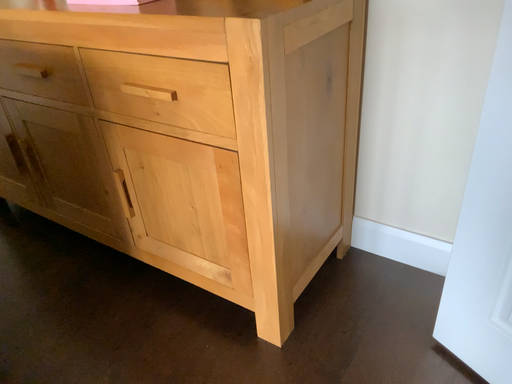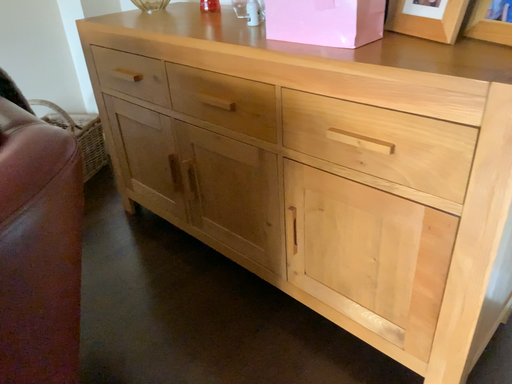
Question: How did the camera likely rotate when shooting the video?

Choices:
 (A) rotated right
 (B) rotated left

Answer: (B)